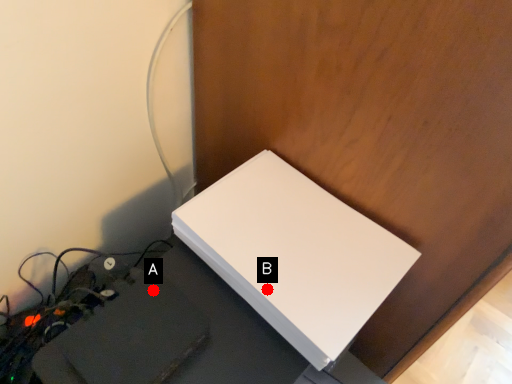
Question: Two points are circled on the image, labeled by A and B beside each circle. Which point appears closest to the camera in this image?

Choices:
 (A) A is closer
 (B) B is closer

Answer: (B)